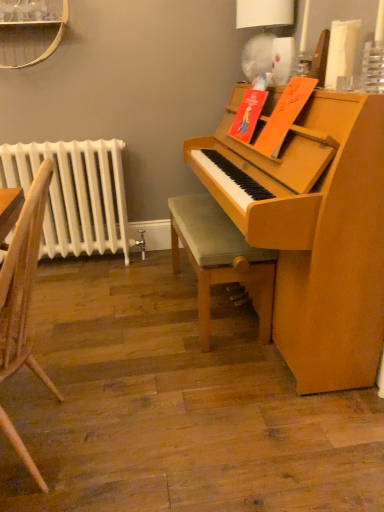
The image size is (384, 512). In order to click on wooden chair at left in this screenshot , I will do `click(23, 282)`.

Is wooden chair at left to the right of white paper lampshade at upper right from the viewer's perspective?

No.

Does wooden chair at left have a lesser height compared to white paper lampshade at upper right?

In fact, wooden chair at left may be taller than white paper lampshade at upper right.

Between green fabric stool at center and white painted metal radiator at left, which one has larger size?

Bigger between the two is green fabric stool at center.

Does green fabric stool at center contain white painted metal radiator at left?

No.

Are green fabric stool at center and white painted metal radiator at left making contact?

There is a gap between green fabric stool at center and white painted metal radiator at left.

Where is `radiator above the green fabric stool at center (from a real-world perspective)`? radiator above the green fabric stool at center (from a real-world perspective) is located at coordinates (76, 195).

Is white painted metal radiator at left in front of or behind wooden chair at left in the image?

white painted metal radiator at left is behind wooden chair at left.

Are white painted metal radiator at left and wooden chair at left beside each other?

No, white painted metal radiator at left is not touching wooden chair at left.

Which is less distant, (120, 221) or (5, 292)?

Point (120, 221).

From a real-world perspective, is white painted metal radiator at left under wooden chair at left?

Yes, from a real-world perspective, white painted metal radiator at left is under wooden chair at left.

Considering the sizes of objects wooden chair at left and white painted metal radiator at left in the image provided, who is wider, wooden chair at left or white painted metal radiator at left?

wooden chair at left.

In the scene shown: Which object is more forward, wooden chair at left or white painted metal radiator at left?

Positioned in front is wooden chair at left.

How much distance is there between wooden chair at left and white painted metal radiator at left?

wooden chair at left is 1.17 meters from white painted metal radiator at left.

Would you say white painted metal radiator at left is inside or outside green fabric stool at center?

white painted metal radiator at left is spatially situated outside green fabric stool at center.

Consider the image. Is white painted metal radiator at left bigger than green fabric stool at center?

No.

Is white painted metal radiator at left touching green fabric stool at center?

They are not placed beside each other.

Is white painted metal radiator at left turned away from green fabric stool at center?

No, white painted metal radiator at left's orientation is not away from green fabric stool at center.

Is point (240, 26) farther from viewer compared to point (32, 145)?

That is False.

From a real-world perspective, is white paper lampshade at upper right on white painted metal radiator at left?

Indeed, from a real-world perspective, white paper lampshade at upper right stands above white painted metal radiator at left.

Is white paper lampshade at upper right wider than white painted metal radiator at left?

In fact, white paper lampshade at upper right might be narrower than white painted metal radiator at left.

In the image, is white paper lampshade at upper right on the left side or the right side of green fabric stool at center?

Clearly, white paper lampshade at upper right is on the right of green fabric stool at center in the image.

From a real-world perspective, who is located lower, white paper lampshade at upper right or green fabric stool at center?

green fabric stool at center is physically lower.

Based on the photo, is white paper lampshade at upper right far away from green fabric stool at center?

No, white paper lampshade at upper right is not far away from green fabric stool at center.

Is white paper lampshade at upper right taller or shorter than green fabric stool at center?

In the image, white paper lampshade at upper right appears to be shorter than green fabric stool at center.

The height and width of the screenshot is (512, 384). I want to click on lamp above the wooden chair at left (from the image's perspective), so (264, 13).

The image size is (384, 512). What are the coordinates of `radiator that is above the green fabric stool at center (from a real-world perspective)` in the screenshot? It's located at (76, 195).

Based on their spatial positions, is wooden chair at left or white paper lampshade at upper right further from green fabric stool at center?

white paper lampshade at upper right is positioned further to the anchor green fabric stool at center.

Based on their spatial positions, is green fabric stool at center or wooden chair at left closer to white painted metal radiator at left?

The object closer to white painted metal radiator at left is green fabric stool at center.

Based on their spatial positions, is white painted metal radiator at left or wooden chair at left further from green fabric stool at center?

white painted metal radiator at left is positioned further to the anchor green fabric stool at center.

Which object lies further to the anchor point white painted metal radiator at left, green fabric stool at center or white paper lampshade at upper right?

white paper lampshade at upper right is positioned further to the anchor white painted metal radiator at left.

Based on their spatial positions, is wooden chair at left or green fabric stool at center further from white paper lampshade at upper right?

Based on the image, wooden chair at left appears to be further to white paper lampshade at upper right.

Looking at the image, which one is located closer to white painted metal radiator at left, white paper lampshade at upper right or wooden chair at left?

The object closer to white painted metal radiator at left is wooden chair at left.

Considering their positions, is green fabric stool at center positioned closer to white paper lampshade at upper right than white painted metal radiator at left?

Based on the image, green fabric stool at center appears to be nearer to white paper lampshade at upper right.

Considering their positions, is white painted metal radiator at left positioned closer to wooden chair at left than white paper lampshade at upper right?

Based on the image, white painted metal radiator at left appears to be nearer to wooden chair at left.

Locate an element on the screen. The image size is (384, 512). radiator between white paper lampshade at upper right and green fabric stool at center in the vertical direction is located at coordinates click(x=76, y=195).

Find the location of a particular element. stool between white paper lampshade at upper right and wooden chair at left vertically is located at coordinates (221, 259).

Locate an element on the screen. stool between wooden chair at left and white painted metal radiator at left from front to back is located at coordinates (221, 259).

The width and height of the screenshot is (384, 512). What are the coordinates of `lamp located between wooden chair at left and white painted metal radiator at left in the depth direction` in the screenshot? It's located at (264, 13).